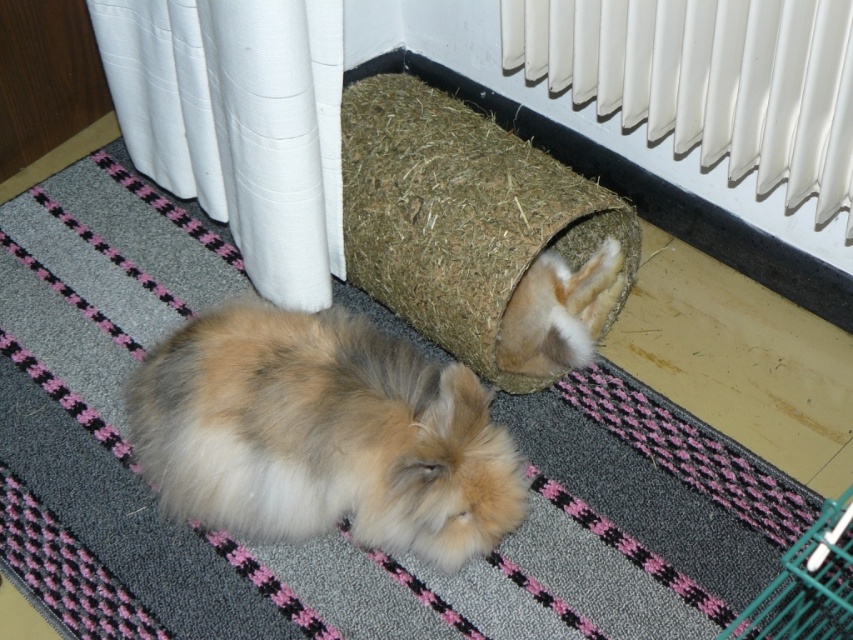
Who is positioned more to the left, white plastic radiator at upper right or fuzzy brown rabbit at lower center?

From the viewer's perspective, fuzzy brown rabbit at lower center appears more on the left side.

Who is more forward, [782,26] or [566,349]?

Point [782,26] is more forward.

The width and height of the screenshot is (853, 640). In order to click on white plastic radiator at upper right in this screenshot , I will do `click(709, 81)`.

This screenshot has height=640, width=853. What are the coordinates of `white plastic radiator at upper right` in the screenshot? It's located at (709, 81).

Which of these two, fluffy fur rabbit at center or fuzzy brown rabbit at lower center, stands shorter?

fuzzy brown rabbit at lower center

Is the position of fluffy fur rabbit at center more distant than that of fuzzy brown rabbit at lower center?

No, fluffy fur rabbit at center is in front of fuzzy brown rabbit at lower center.

Which is in front, point (201, 396) or point (566, 316)?

Positioned in front is point (201, 396).

The height and width of the screenshot is (640, 853). What are the coordinates of `fluffy fur rabbit at center` in the screenshot? It's located at (322, 435).

Which is in front, point (193, 100) or point (514, 364)?

Positioned in front is point (514, 364).

Between white fabric curtain at left and fuzzy brown rabbit at lower center, which one appears on the right side from the viewer's perspective?

fuzzy brown rabbit at lower center is more to the right.

Image resolution: width=853 pixels, height=640 pixels. I want to click on white fabric curtain at left, so click(x=239, y=124).

Locate an element on the screen. This screenshot has width=853, height=640. white fabric curtain at left is located at coordinates (239, 124).